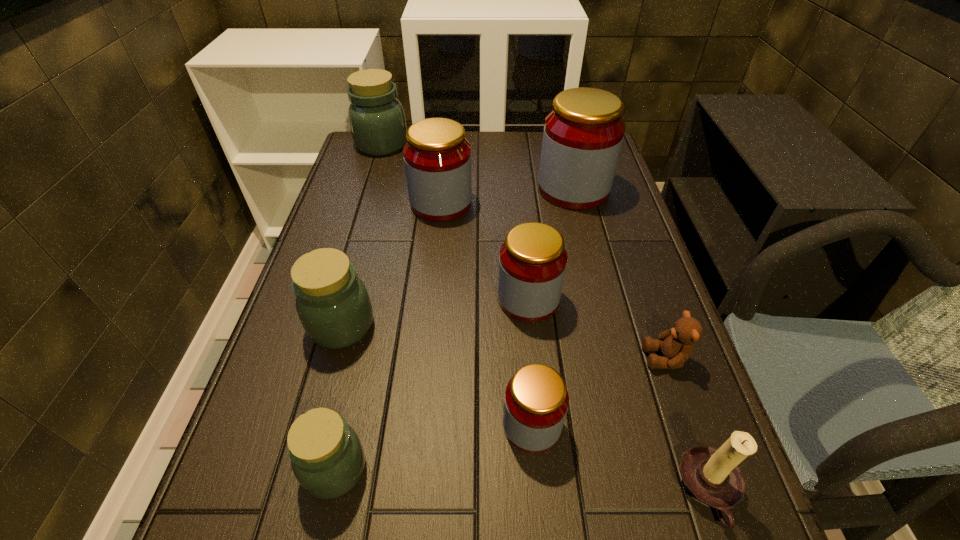
Locate an element on the screen. This screenshot has width=960, height=540. object that is the second nearest to the teddy bear is located at coordinates (532, 262).

Select which object appears as the closest to the brown candle holder. Please provide its 2D coordinates. Your answer should be formatted as a tuple, i.e. [(x, y)], where the tuple contains the x and y coordinates of a point satisfying the conditions above.

[(676, 345)]

Where is `jar that stands as the sixth closest to the leftmost red jar`? The width and height of the screenshot is (960, 540). jar that stands as the sixth closest to the leftmost red jar is located at coordinates (327, 457).

Locate an element on the screen. jar that is the fifth closest to the candle holder is located at coordinates coord(583,134).

Identify which red jar is the fourth closest to the candle holder. Please provide its 2D coordinates. Your answer should be formatted as a tuple, i.e. [(x, y)], where the tuple contains the x and y coordinates of a point satisfying the conditions above.

[(437, 157)]

Where is `red jar that stands as the second closest to the second nearest red jar`? The image size is (960, 540). red jar that stands as the second closest to the second nearest red jar is located at coordinates (437, 157).

Locate which green jar is the third closest to the biggest red jar. Please provide its 2D coordinates. Your answer should be formatted as a tuple, i.e. [(x, y)], where the tuple contains the x and y coordinates of a point satisfying the conditions above.

[(327, 457)]

Locate which green jar is the second closest to the tallest object. Please provide its 2D coordinates. Your answer should be formatted as a tuple, i.e. [(x, y)], where the tuple contains the x and y coordinates of a point satisfying the conditions above.

[(333, 305)]

The image size is (960, 540). What are the coordinates of `vacant space that satisfies the following two spatial constraints: 1. on the back side of the smallest red jar; 2. on the right side of the third farthest red jar` in the screenshot? It's located at (521, 299).